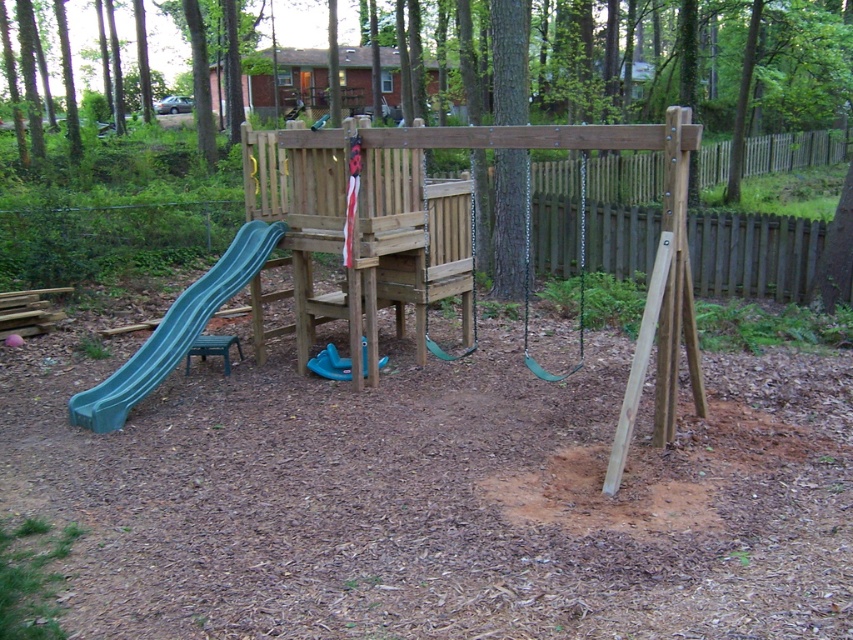
Does green rubber swing at center appear on the left side of wooden swing at center?

No, green rubber swing at center is not to the left of wooden swing at center.

Is point (523, 305) more distant than point (425, 182)?

Yes.

This screenshot has height=640, width=853. I want to click on green rubber swing at center, so click(578, 276).

Who is more forward, (231, 248) or (424, 316)?

Point (231, 248) is more forward.

Does teal plastic slide at left appear on the right side of wooden swing at center?

No, teal plastic slide at left is not to the right of wooden swing at center.

Where is `teal plastic slide at left`? The image size is (853, 640). teal plastic slide at left is located at coordinates pyautogui.click(x=175, y=330).

Find the location of a particular element. The image size is (853, 640). teal plastic slide at left is located at coordinates (175, 330).

Does teal plastic slide at left appear under green rubber swing at center?

Correct, teal plastic slide at left is located below green rubber swing at center.

Can you confirm if teal plastic slide at left is positioned to the left of green rubber swing at center?

Yes, teal plastic slide at left is to the left of green rubber swing at center.

You are a GUI agent. You are given a task and a screenshot of the screen. Output one action in this format:
    pyautogui.click(x=<x>, y=<y>)
    Task: Click on the teal plastic slide at left
    The height and width of the screenshot is (640, 853).
    Given the screenshot: What is the action you would take?
    pyautogui.click(x=175, y=330)